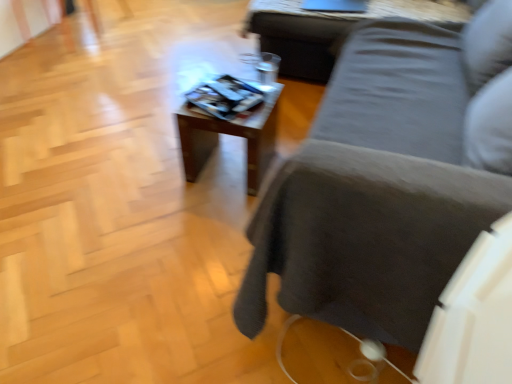
Question: Is wooden table at upper center, which is the first table in right-to-left order, inside the boundaries of wooden table at center, acting as the 2th table starting from the right, or outside?

Choices:
 (A) inside
 (B) outside

Answer: (B)

Question: Considering their positions, is wooden table at upper center, which is the first table in right-to-left order, located in front of or behind wooden table at center, which is the 2th table in top-to-bottom order?

Choices:
 (A) behind
 (B) front

Answer: (A)

Question: Which object is the closest to the wooden table at upper center, the 2th table in the left-to-right sequence?

Choices:
 (A) dark gray fabric couch at center
 (B) wooden table at center, which is the 2th table in top-to-bottom order

Answer: (B)

Question: Estimate the real-world distances between objects in this image. Which object is farther from the wooden table at center, placed as the first table when sorted from bottom to top?

Choices:
 (A) wooden table at upper center, placed as the first table when sorted from top to bottom
 (B) dark gray fabric couch at center

Answer: (A)